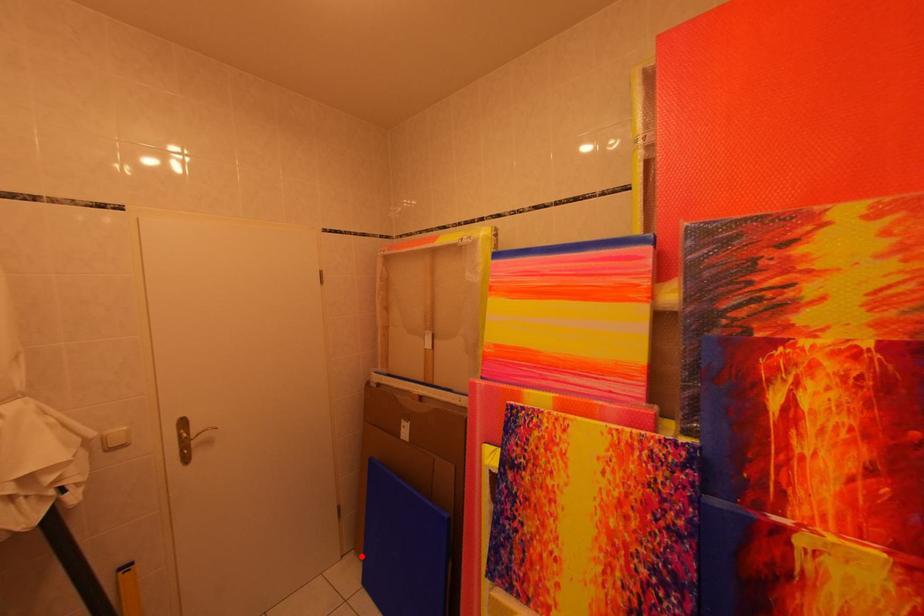
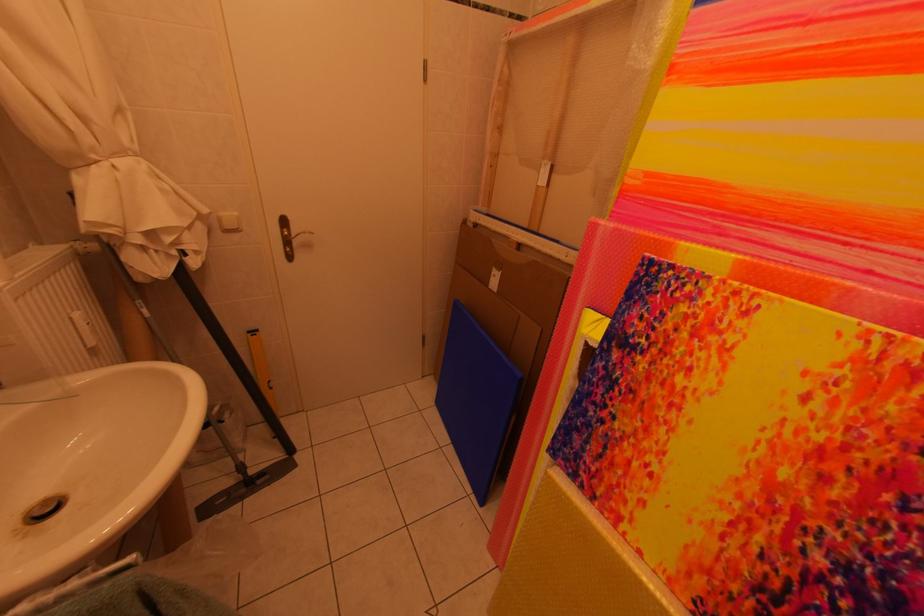
In the second image, find the point that corresponds to the highlighted location in the first image.

(442, 379)